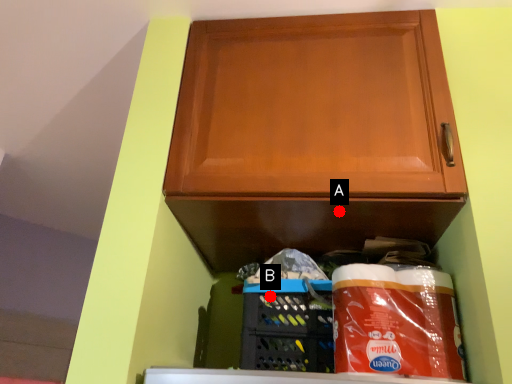
Question: Two points are circled on the image, labeled by A and B beside each circle. Which point appears closest to the camera in this image?

Choices:
 (A) A is closer
 (B) B is closer

Answer: (A)